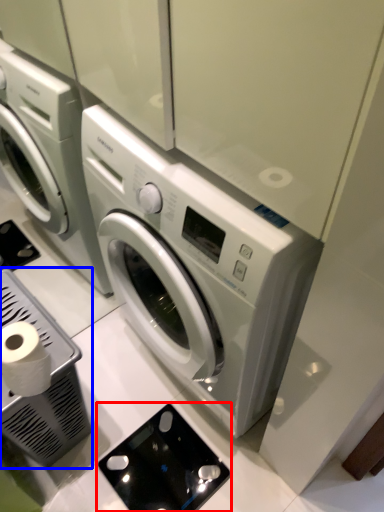
Question: Which object appears closest to the camera in this image, appliance (highlighted by a red box) or appliance (highlighted by a blue box)?

Choices:
 (A) appliance
 (B) appliance

Answer: (B)